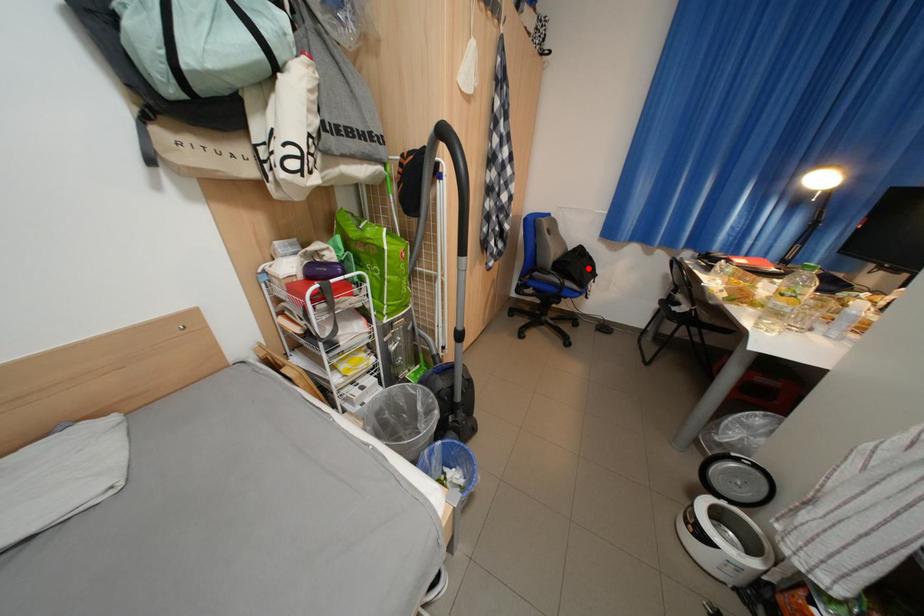
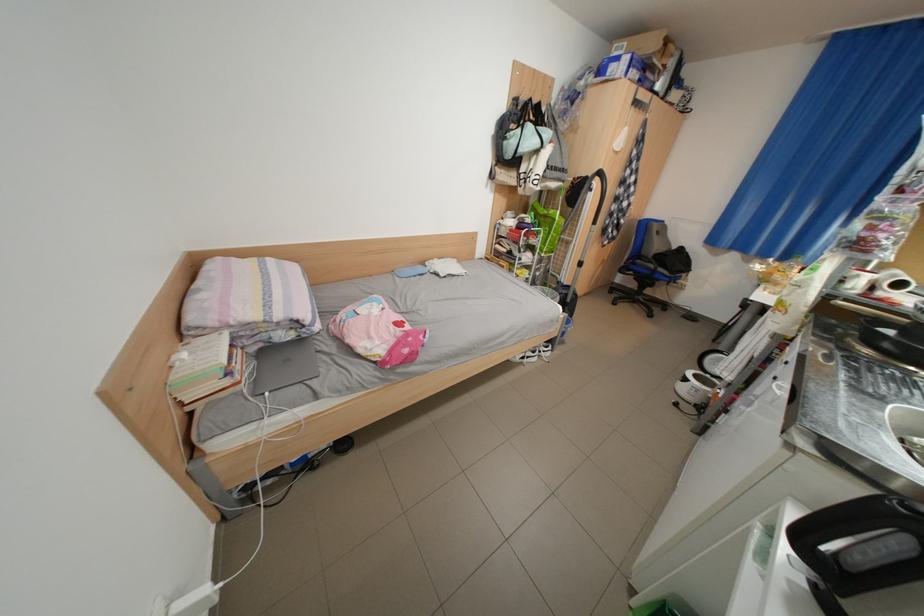
Find the pixel in the second image that matches the highlighted location in the first image.

(687, 264)